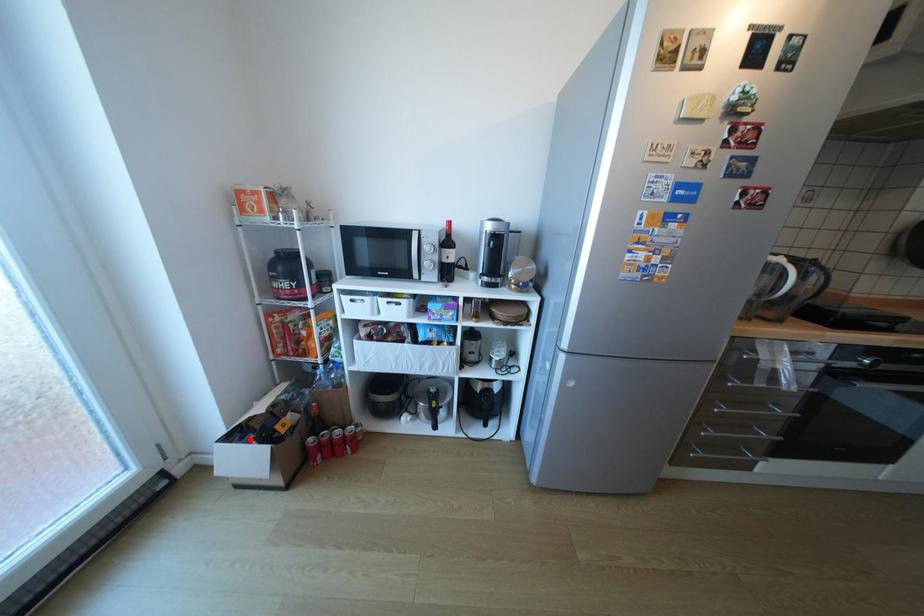
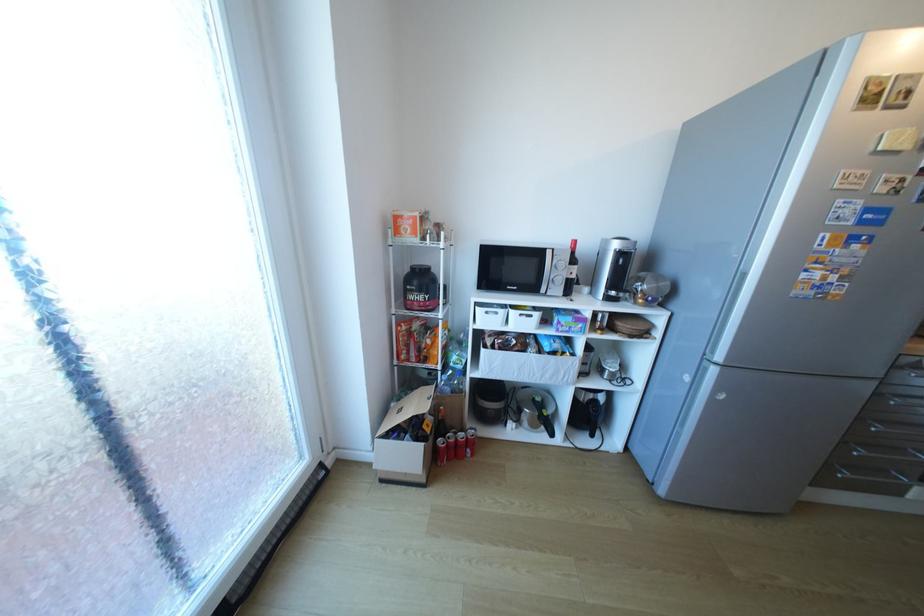
The point at the highlighted location is marked in the first image. Where is the corresponding point in the second image?

(407, 437)